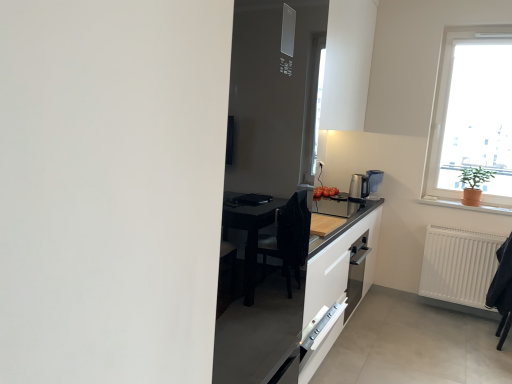
Where is `white glass window at upper right`? This screenshot has width=512, height=384. white glass window at upper right is located at coordinates (472, 115).

Measure the distance between point (420, 199) and camera.

Point (420, 199) and camera are 3.78 meters apart from each other.

At what (x,y) coordinates should I click in order to perform the action: click on green matte plant at upper right. Please return your answer as a coordinate pair (x, y). The height and width of the screenshot is (384, 512). Looking at the image, I should click on (475, 176).

In the image, is orange clay pot at right positioned in front of or behind green matte plant at upper right?

orange clay pot at right is in front of green matte plant at upper right.

Does orange clay pot at right have a lesser width compared to green matte plant at upper right?

Indeed, orange clay pot at right has a lesser width compared to green matte plant at upper right.

The width and height of the screenshot is (512, 384). I want to click on plant that appears above the orange clay pot at right (from a real-world perspective), so click(x=475, y=176).

Is orange clay pot at right inside the boundaries of green matte plant at upper right, or outside?

→ orange clay pot at right is not enclosed by green matte plant at upper right.

Find the location of `plant above the white matte radiator at lower right (from a real-world perspective)`. plant above the white matte radiator at lower right (from a real-world perspective) is located at coordinates (475, 176).

What's the angular difference between green matte plant at upper right and white matte radiator at lower right's facing directions?

green matte plant at upper right and white matte radiator at lower right are facing 0.585 degrees away from each other.

Does green matte plant at upper right have a larger size compared to white matte radiator at lower right?

Actually, green matte plant at upper right might be smaller than white matte radiator at lower right.

Is the depth of green matte plant at upper right greater than that of white matte radiator at lower right?

Yes, green matte plant at upper right is further from the viewer.

Is white plastic electric outlet at upper center at the back of orange clay pot at right?

No, orange clay pot at right is not facing the opposite direction of white plastic electric outlet at upper center.

This screenshot has height=384, width=512. Find the location of `electric outlet that appears on the left of orange clay pot at right`. electric outlet that appears on the left of orange clay pot at right is located at coordinates (320, 164).

Is orange clay pot at right positioned far away from white plastic electric outlet at upper center?

Yes, orange clay pot at right is far from white plastic electric outlet at upper center.

Considering the relative sizes of satin silver coffee machine at right and orange clay pot at right in the image provided, is satin silver coffee machine at right thinner than orange clay pot at right?

No.

Considering the positions of objects satin silver coffee machine at right and orange clay pot at right in the image provided, who is behind, satin silver coffee machine at right or orange clay pot at right?

Positioned behind is satin silver coffee machine at right.

In the scene shown: Could you tell me if satin silver coffee machine at right is facing orange clay pot at right?

No, satin silver coffee machine at right is not oriented towards orange clay pot at right.

Based on their sizes in the image, would you say satin silver coffee machine at right is bigger or smaller than orange clay pot at right?

satin silver coffee machine at right is bigger than orange clay pot at right.

Is point (320, 165) more distant than point (470, 184)?

Yes.

From a real-world perspective, is white plastic electric outlet at upper center physically above green matte plant at upper right?

Yes.

Is white plastic electric outlet at upper center not close to green matte plant at upper right?

Yes, white plastic electric outlet at upper center and green matte plant at upper right are located far from each other.

Is white plastic electric outlet at upper center facing away from green matte plant at upper right?

white plastic electric outlet at upper center is not turned away from green matte plant at upper right.

Can you confirm if white plastic electric outlet at upper center is smaller than orange clay pot at right?

Yes, white plastic electric outlet at upper center is smaller than orange clay pot at right.

Is white plastic electric outlet at upper center taller or shorter than orange clay pot at right?

white plastic electric outlet at upper center is taller than orange clay pot at right.

Is white plastic electric outlet at upper center inside the boundaries of orange clay pot at right, or outside?

white plastic electric outlet at upper center is not inside orange clay pot at right, it's outside.

Considering the relative positions of white plastic electric outlet at upper center and orange clay pot at right in the image provided, is white plastic electric outlet at upper center behind orange clay pot at right?

Yes, white plastic electric outlet at upper center is further from the camera.

What's the angular difference between satin silver coffee machine at right and green matte plant at upper right's facing directions?

89.6 degrees.

Is satin silver coffee machine at right facing away from green matte plant at upper right?

That's not correct — satin silver coffee machine at right is not looking away from green matte plant at upper right.

Does satin silver coffee machine at right have a greater width compared to green matte plant at upper right?

No.

Between satin silver coffee machine at right and green matte plant at upper right, which one has less height?

satin silver coffee machine at right.

The width and height of the screenshot is (512, 384). I want to click on window sill in front of the green matte plant at upper right, so click(466, 205).

Image resolution: width=512 pixels, height=384 pixels. Find the location of `radiator below the green matte plant at upper right (from a real-world perspective)`. radiator below the green matte plant at upper right (from a real-world perspective) is located at coordinates (459, 266).

When comparing their distances from satin silver coffee machine at right, does white plastic electric outlet at upper center or green matte plant at upper right seem closer?

white plastic electric outlet at upper center is closer to satin silver coffee machine at right.

Estimate the real-world distances between objects in this image. Which object is further from orange clay pot at right, white plastic electric outlet at upper center or white glass window at upper right?

white plastic electric outlet at upper center lies further to orange clay pot at right than the other object.

Considering their positions, is white plastic electric outlet at upper center positioned further to white glass window at upper right than orange clay pot at right?

Among the two, white plastic electric outlet at upper center is located further to white glass window at upper right.

When comparing their distances from white glass window at upper right, does orange clay pot at right or white matte radiator at lower right seem closer?

The object closer to white glass window at upper right is orange clay pot at right.

Which object lies further to the anchor point white glass window at upper right, white plastic electric outlet at upper center or white matte radiator at lower right?

Among the two, white plastic electric outlet at upper center is located further to white glass window at upper right.

Based on their spatial positions, is white matte radiator at lower right or green matte plant at upper right further from white glass window at upper right?

white matte radiator at lower right lies further to white glass window at upper right than the other object.

Which object lies nearer to the anchor point white plastic electric outlet at upper center, white matte radiator at lower right or satin silver coffee machine at right?

satin silver coffee machine at right lies closer to white plastic electric outlet at upper center than the other object.

Considering their positions, is white matte radiator at lower right positioned closer to orange clay pot at right than green matte plant at upper right?

green matte plant at upper right lies closer to orange clay pot at right than the other object.

Locate an element on the screen. The width and height of the screenshot is (512, 384). radiator between satin silver coffee machine at right and orange clay pot at right in the horizontal direction is located at coordinates (459, 266).

Locate an element on the screen. This screenshot has height=384, width=512. radiator situated between white plastic electric outlet at upper center and green matte plant at upper right from left to right is located at coordinates (459, 266).

Identify the location of window sill between green matte plant at upper right and white matte radiator at lower right from top to bottom. (466, 205).

You are a GUI agent. You are given a task and a screenshot of the screen. Output one action in this format:
    pyautogui.click(x=<x>, y=<y>)
    Task: Click on the plant between white plastic electric outlet at upper center and white glass window at upper right
    Image resolution: width=512 pixels, height=384 pixels.
    Given the screenshot: What is the action you would take?
    pyautogui.click(x=475, y=176)